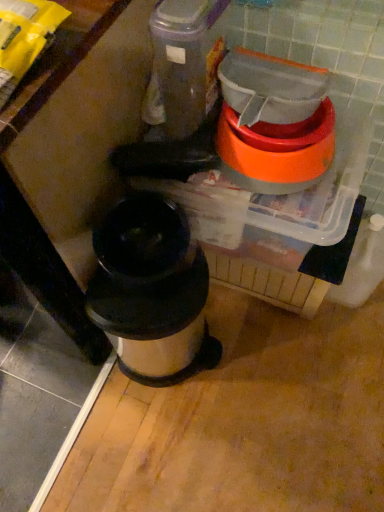
Question: Is point (165, 314) positioned closer to the camera than point (230, 121)?

Choices:
 (A) farther
 (B) closer

Answer: (A)

Question: From the image's perspective, is stainless steel trash can at center positioned above or below orange plastic bowl at upper right?

Choices:
 (A) below
 (B) above

Answer: (A)

Question: Do you think stainless steel trash can at center is within orange plastic bowl at upper right, or outside of it?

Choices:
 (A) outside
 (B) inside

Answer: (A)

Question: Is orange plastic bowl at upper right situated inside stainless steel trash can at center or outside?

Choices:
 (A) outside
 (B) inside

Answer: (A)

Question: From the image's perspective, relative to stainless steel trash can at center, is orange plastic bowl at upper right above or below?

Choices:
 (A) below
 (B) above

Answer: (B)

Question: Considering the positions of orange plastic bowl at upper right and stainless steel trash can at center in the image, is orange plastic bowl at upper right bigger or smaller than stainless steel trash can at center?

Choices:
 (A) big
 (B) small

Answer: (B)

Question: From their relative heights in the image, would you say orange plastic bowl at upper right is taller or shorter than stainless steel trash can at center?

Choices:
 (A) short
 (B) tall

Answer: (A)